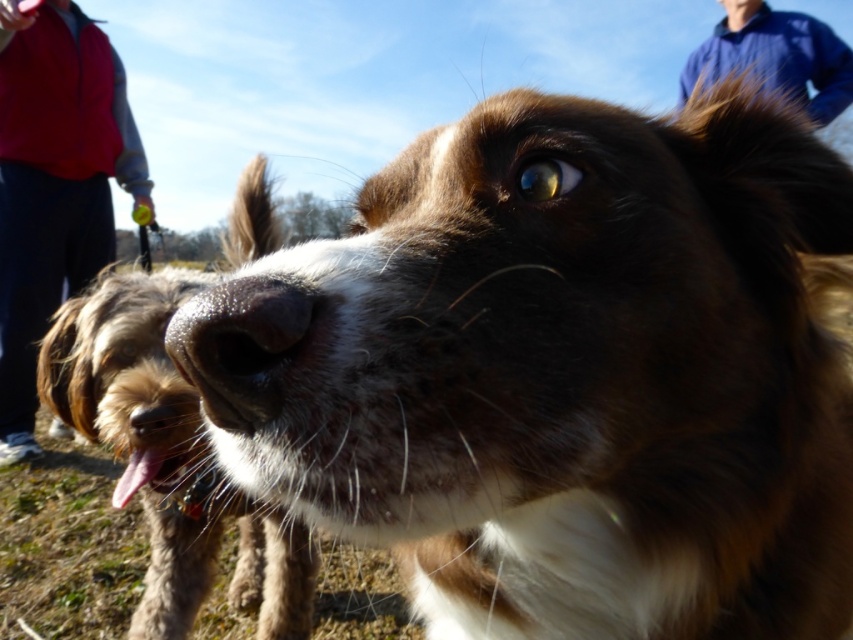
Question: Can you confirm if blue cotton shirt at upper right is wider than pink fur at lower left?

Choices:
 (A) yes
 (B) no

Answer: (A)

Question: Does wet fur at nose center have a greater width compared to blue cotton shirt at upper right?

Choices:
 (A) yes
 (B) no

Answer: (B)

Question: Which point is farther from the camera taking this photo?

Choices:
 (A) (822, 97)
 (B) (68, 189)
 (C) (173, 614)

Answer: (B)

Question: Which point appears farthest from the camera in this image?

Choices:
 (A) (795, 81)
 (B) (120, 502)

Answer: (A)

Question: Can you confirm if red fleece jacket at left is positioned to the right of pink fur at lower left?

Choices:
 (A) yes
 (B) no

Answer: (B)

Question: Considering the real-world distances, which object is farthest from the brown fuzzy dog at center?

Choices:
 (A) blue cotton shirt at upper right
 (B) red fleece jacket at left
 (C) wet fur at nose center

Answer: (A)